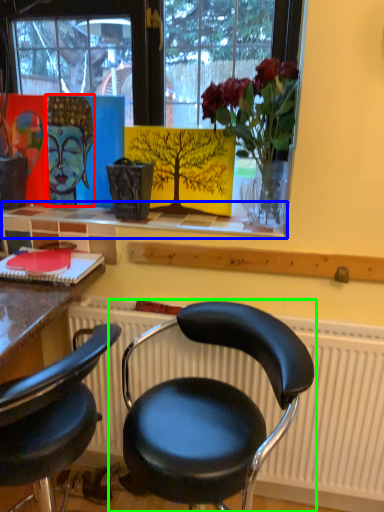
Question: Estimate the real-world distances between objects in this image. Which object is closer to art (highlighted by a red box), window sill (highlighted by a blue box) or chair (highlighted by a green box)?

Choices:
 (A) window sill
 (B) chair

Answer: (A)